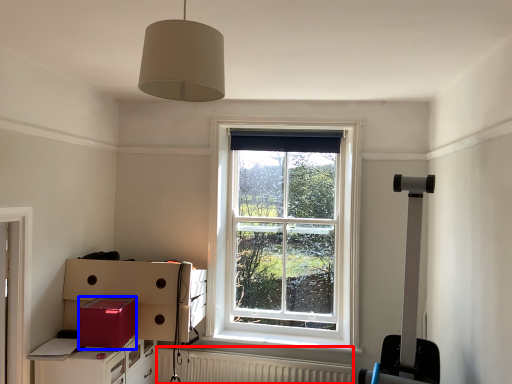
Question: Which object appears closest to the camera in this image, radiator (highlighted by a red box) or cardboard box (highlighted by a blue box)?

Choices:
 (A) radiator
 (B) cardboard box

Answer: (B)